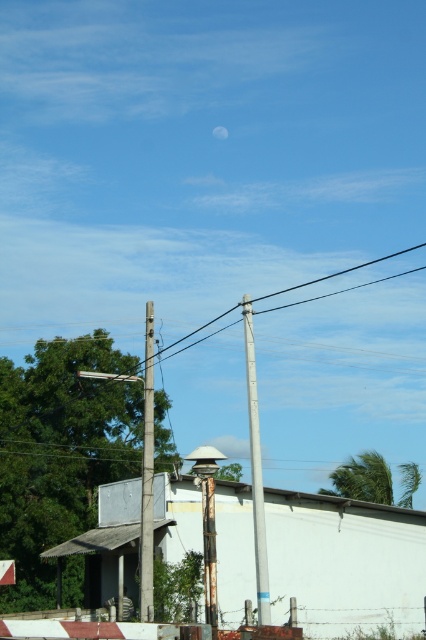
Question: Is metallic gray telegraph pole at center to the right of smooth gray pole at left from the viewer's perspective?

Choices:
 (A) no
 (B) yes

Answer: (B)

Question: Is metallic gray telegraph pole at center bigger than smooth gray pole at left?

Choices:
 (A) no
 (B) yes

Answer: (A)

Question: Can you confirm if metallic gray telegraph pole at center is positioned to the left of smooth gray pole at left?

Choices:
 (A) no
 (B) yes

Answer: (A)